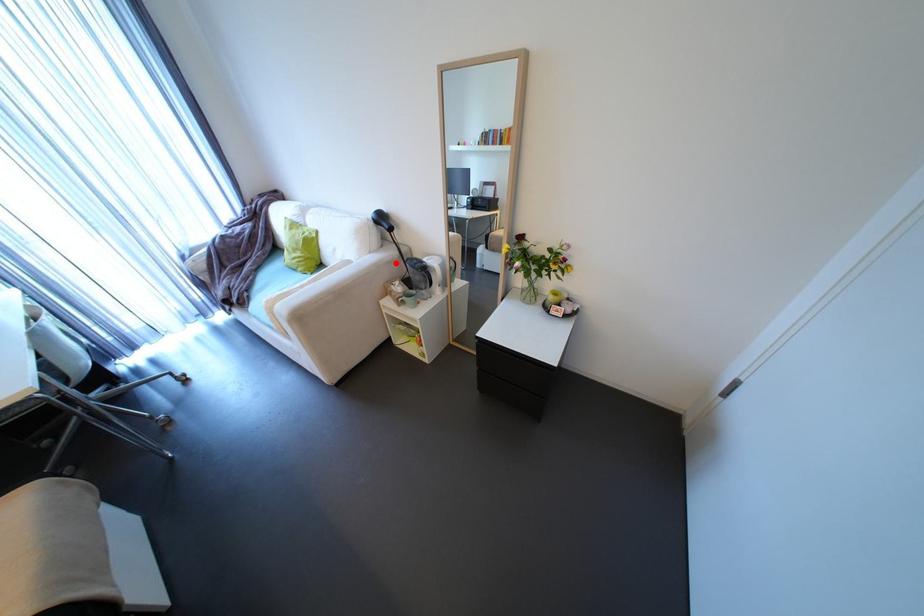
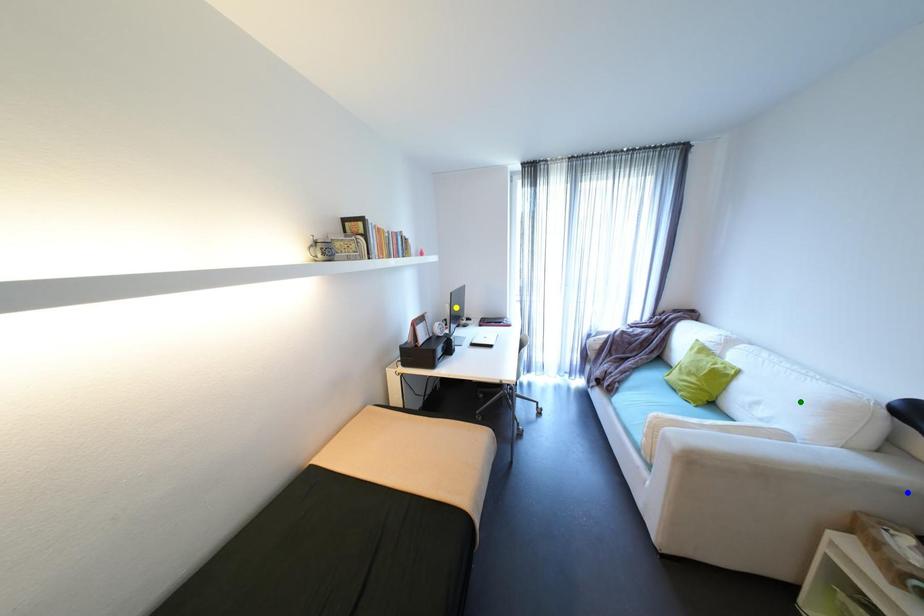
Question: I am providing you with two images of the same scene from different viewpoints. A red point is marked on the first image. You are given multiple points on the second image. Which point in image 2 is actually the same real-world point as the red point in image 1?

Choices:
 (A) green point
 (B) yellow point
 (C) blue point

Answer: (C)